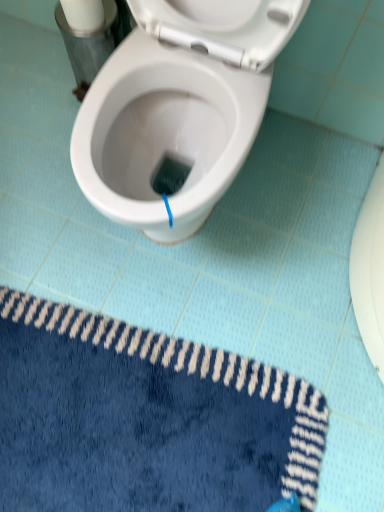
Question: Is white matte toilet paper at upper left spatially inside blue plush bath mat at lower left, or outside of it?

Choices:
 (A) outside
 (B) inside

Answer: (A)

Question: In terms of height, does white matte toilet paper at upper left look taller or shorter compared to blue plush bath mat at lower left?

Choices:
 (A) tall
 (B) short

Answer: (A)

Question: Considering the positions of white matte toilet paper at upper left and blue plush bath mat at lower left in the image, is white matte toilet paper at upper left wider or thinner than blue plush bath mat at lower left?

Choices:
 (A) thin
 (B) wide

Answer: (A)

Question: From a real-world perspective, is blue plush bath mat at lower left physically located above or below white matte toilet paper at upper left?

Choices:
 (A) above
 (B) below

Answer: (B)

Question: Considering the positions of blue plush bath mat at lower left and white matte toilet paper at upper left in the image, is blue plush bath mat at lower left wider or thinner than white matte toilet paper at upper left?

Choices:
 (A) thin
 (B) wide

Answer: (B)

Question: From their relative heights in the image, would you say blue plush bath mat at lower left is taller or shorter than white matte toilet paper at upper left?

Choices:
 (A) short
 (B) tall

Answer: (A)

Question: In terms of size, does blue plush bath mat at lower left appear bigger or smaller than white matte toilet paper at upper left?

Choices:
 (A) small
 (B) big

Answer: (B)